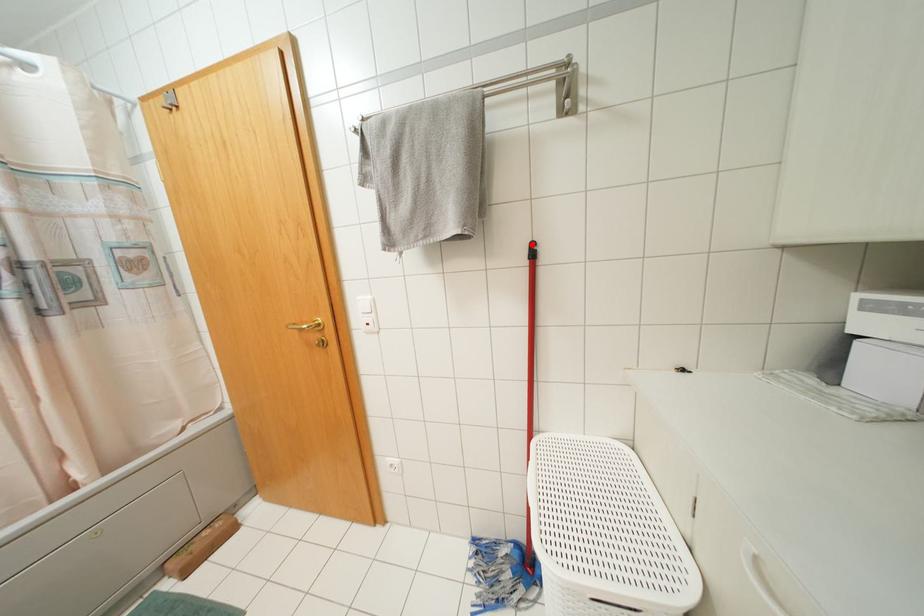
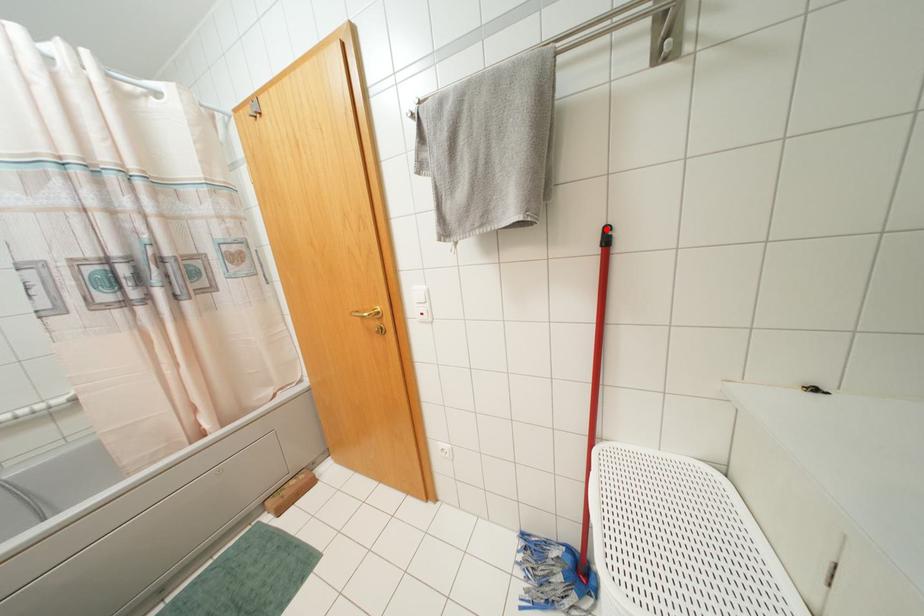
I am providing you with two images of the same scene from different viewpoints. A red point is marked on the first image and another point is marked on the second image. Does the point marked in image1 correspond to the same location as the one in image2?

Yes